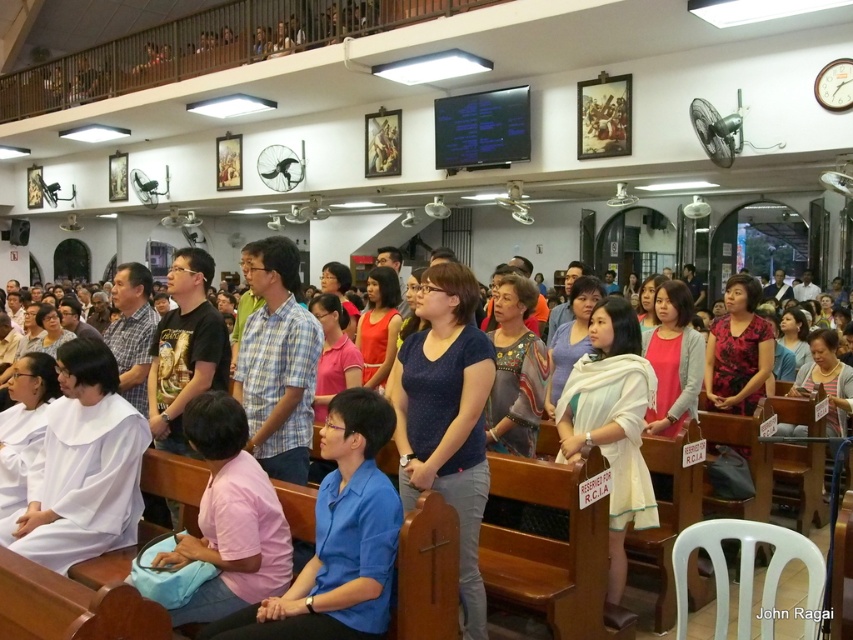
Who is more distant from viewer, (323, 596) or (440, 554)?

The point (440, 554) is more distant.

Looking at this image, between blue smooth shirt at lower center and blue fabric shirt at center, which one has more height?

blue smooth shirt at lower center is taller.

Does point (378, 436) lie in front of point (436, 618)?

No, (378, 436) is further to viewer.

Where is `blue smooth shirt at lower center`? This screenshot has width=853, height=640. blue smooth shirt at lower center is located at coordinates (338, 540).